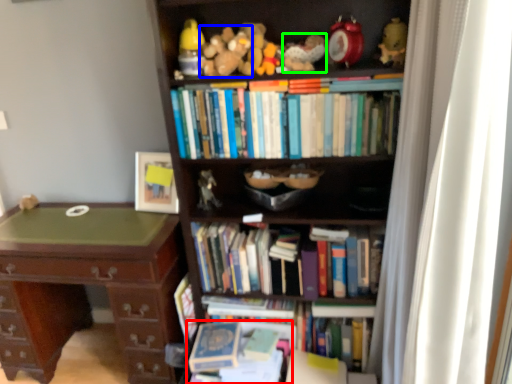
Question: Which object is positioned farthest from book (highlighted by a red box)? Select from toy (highlighted by a blue box) and toy (highlighted by a green box).

Choices:
 (A) toy
 (B) toy

Answer: (B)